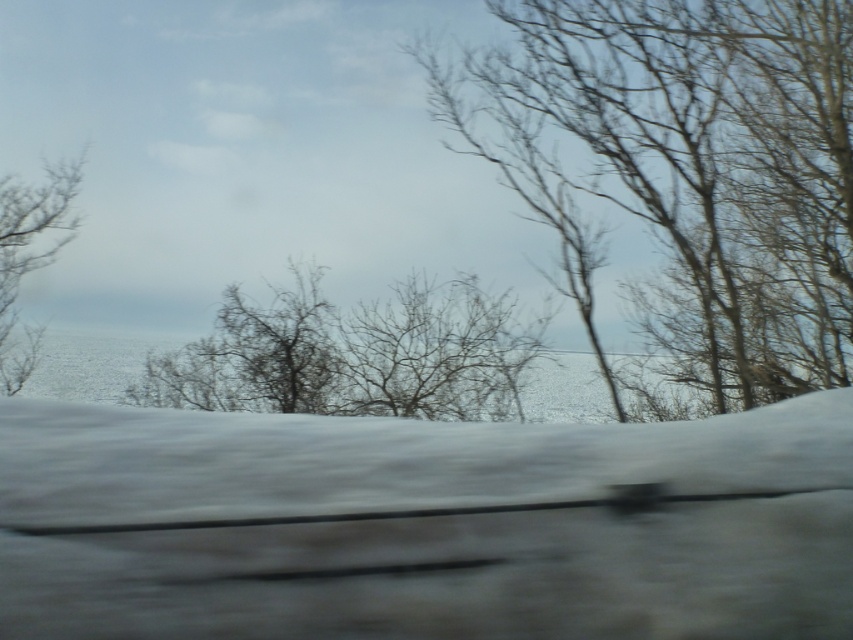
You are driving a car and want to know if the distance between the bare branches at right and the bare branches at left is more than 8 meters. Can you confirm?

The distance between the bare branches at right and the bare branches at left is 7.98 meters, so it is less than 8 meters.

In the scene shown: You are driving through a snowy forest and notice two clusters of bare branches at the side of the road. The first is labeled as bare branches at left, and the second is labeled as bare branches at right. From your perspective inside the car, which cluster is closer to the right side of the road?

The bare branches at right is to the right of the bare branches at left, so the cluster labeled bare branches at right is closer to the right side of the road.